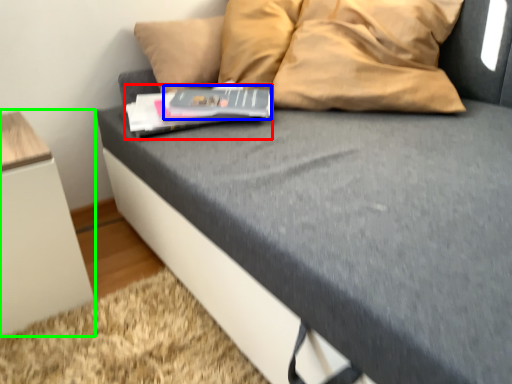
Question: Which object is positioned closest to paperback book (highlighted by a red box)? Select from paperback book (highlighted by a blue box) and furniture (highlighted by a green box).

Choices:
 (A) paperback book
 (B) furniture

Answer: (A)